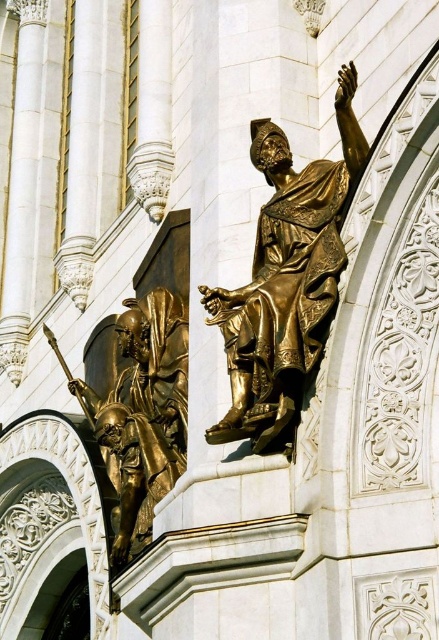
Question: Does shiny gold statue at center appear under gold-bronze statue at center?

Choices:
 (A) yes
 (B) no

Answer: (B)

Question: Is shiny gold statue at center thinner than gold-bronze statue at center?

Choices:
 (A) yes
 (B) no

Answer: (A)

Question: Which object is farther from the camera taking this photo?

Choices:
 (A) shiny gold statue at center
 (B) gold-bronze statue at center

Answer: (B)

Question: Does shiny gold statue at center have a smaller size compared to gold-bronze statue at center?

Choices:
 (A) no
 (B) yes

Answer: (B)